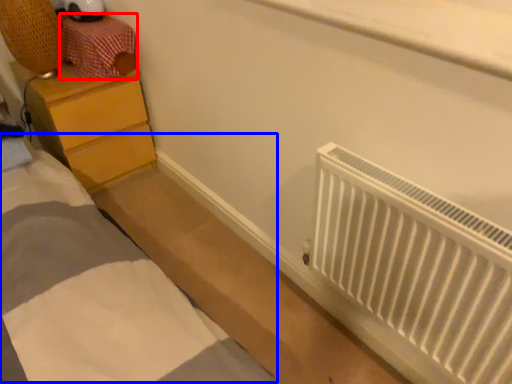
Question: Which point is closer to the camera, drawer (highlighted by a red box) or bed (highlighted by a blue box)?

Choices:
 (A) drawer
 (B) bed

Answer: (B)